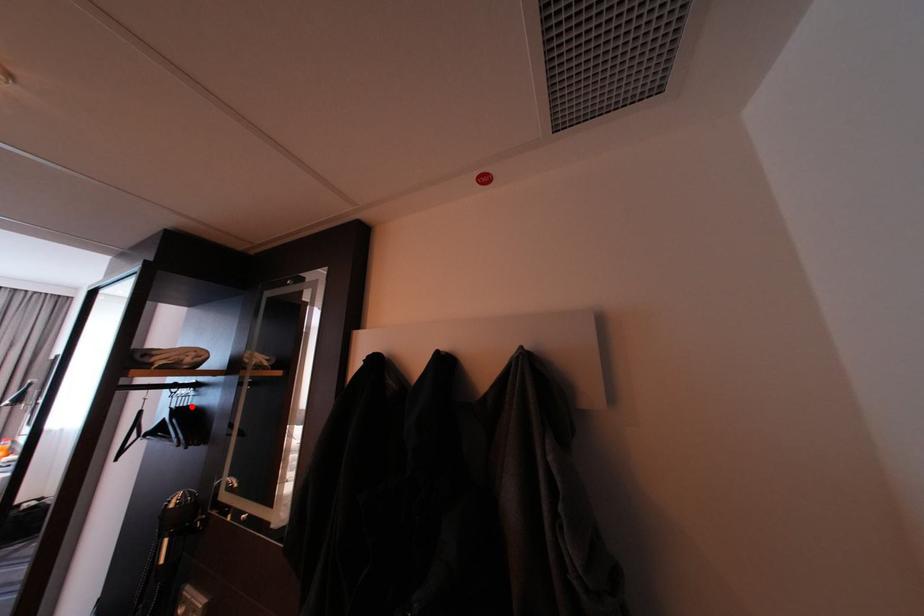
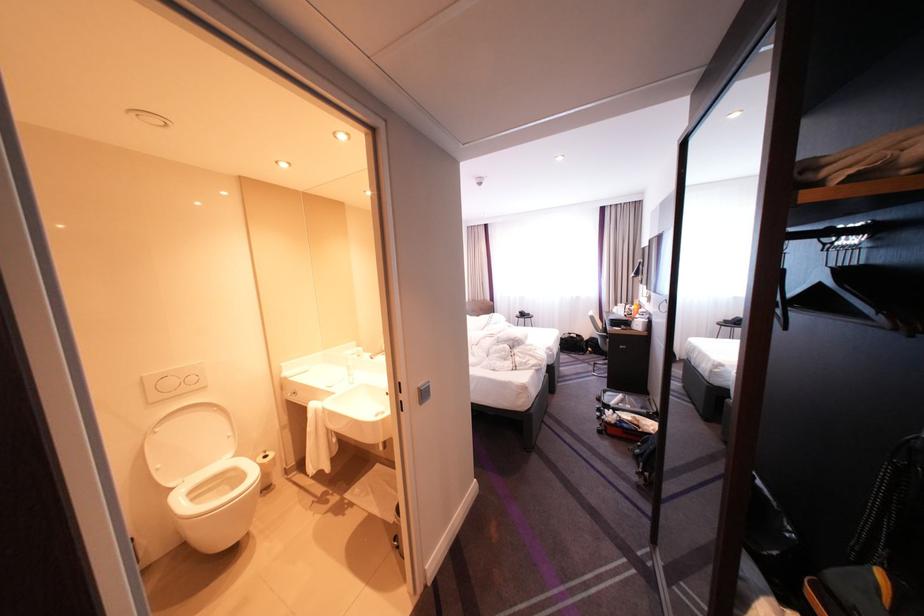
Locate, in the second image, the point that corresponds to the highlighted location in the first image.

(855, 265)